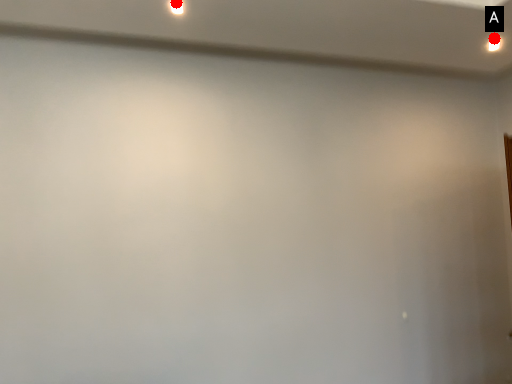
Question: Two points are circled on the image, labeled by A and B beside each circle. Which of the following is the closest to the observer?

Choices:
 (A) A is closer
 (B) B is closer

Answer: (B)